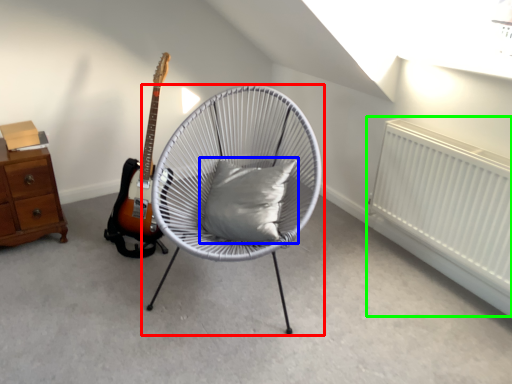
Question: Which object is the closest to the chair (highlighted by a red box)? Choose among these: pillow (highlighted by a blue box) or radiator (highlighted by a green box).

Choices:
 (A) pillow
 (B) radiator

Answer: (A)